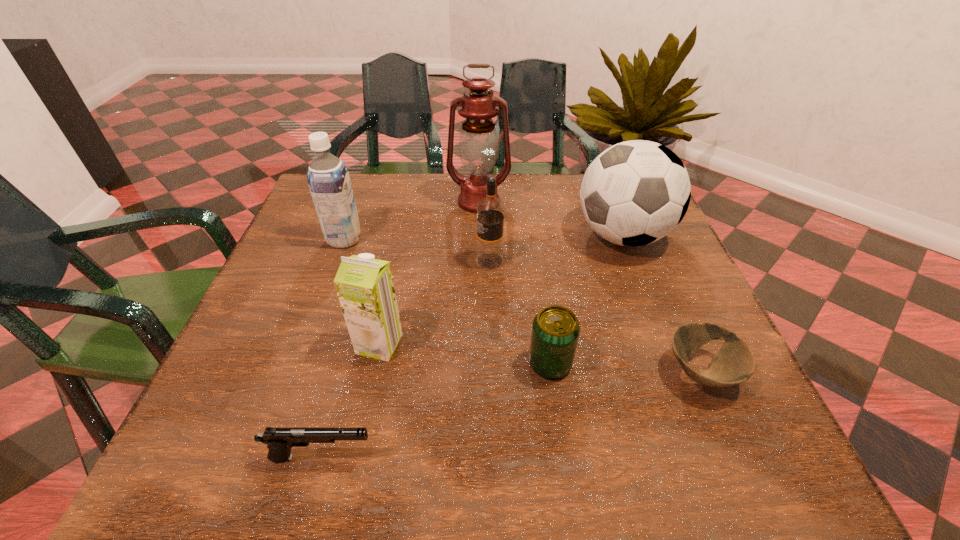
Where is `free point located 0.380m on the right of the nearer soya milk`? This screenshot has height=540, width=960. free point located 0.380m on the right of the nearer soya milk is located at coordinates (600, 344).

At what (x,y) coordinates should I click in order to perform the action: click on free region located 0.150m on the front of the sixth tallest object. Please return your answer as a coordinate pair (x, y). Looking at the image, I should click on (564, 466).

Where is `blank area located at the aiming end of the gun`? The image size is (960, 540). blank area located at the aiming end of the gun is located at coordinates (439, 457).

Locate an element on the screen. The height and width of the screenshot is (540, 960). vacant space located 0.130m on the left of the bowl is located at coordinates (591, 373).

I want to click on oil lamp positioned at the far edge, so click(478, 144).

The image size is (960, 540). Identify the location of soccer ball at the far edge. (634, 193).

Identify the location of object that is at the near edge. (279, 440).

Identify the location of soya milk that is at the left edge. This screenshot has height=540, width=960. (328, 178).

Image resolution: width=960 pixels, height=540 pixels. I want to click on gun that is positioned at the left edge, so click(x=279, y=440).

Identify the location of soccer ball located in the right edge section of the desktop. (634, 193).